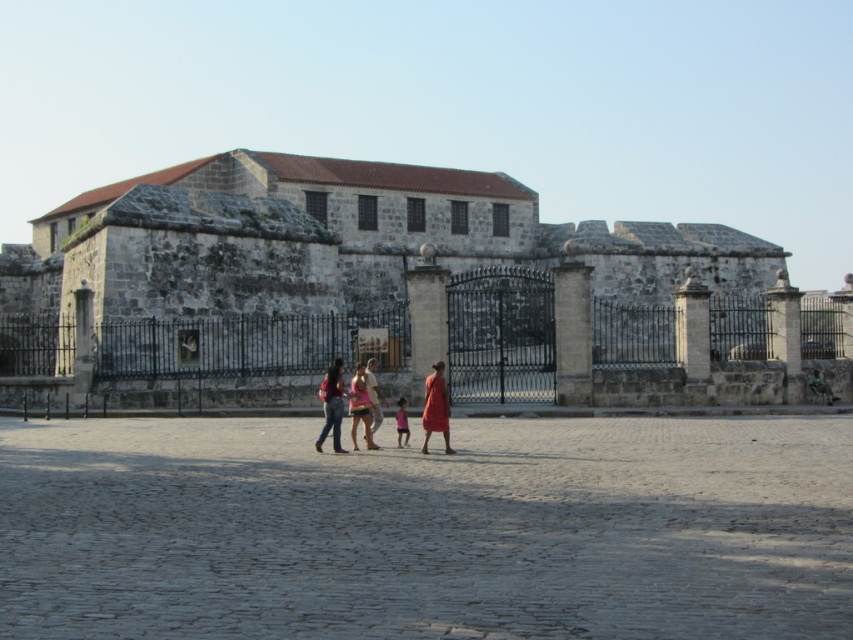
Question: Can you confirm if gray cobblestone plaza at center is positioned to the left of stone wall at center?

Choices:
 (A) yes
 (B) no

Answer: (B)

Question: Which object is closer to the camera taking this photo?

Choices:
 (A) gray cobblestone plaza at center
 (B) pink satin dress at center
 (C) matte black pants at center

Answer: (A)

Question: Can you confirm if gray cobblestone plaza at center is wider than pink fabric dress at center?

Choices:
 (A) no
 (B) yes

Answer: (B)

Question: Which point is farther from the camera taking this photo?

Choices:
 (A) (439, 380)
 (B) (370, 410)

Answer: (B)

Question: Is matte orange dress at center to the left of pink satin dress at center from the viewer's perspective?

Choices:
 (A) yes
 (B) no

Answer: (B)

Question: Which point is farther from the camera taking this photo?

Choices:
 (A) (723, 508)
 (B) (440, 420)

Answer: (B)